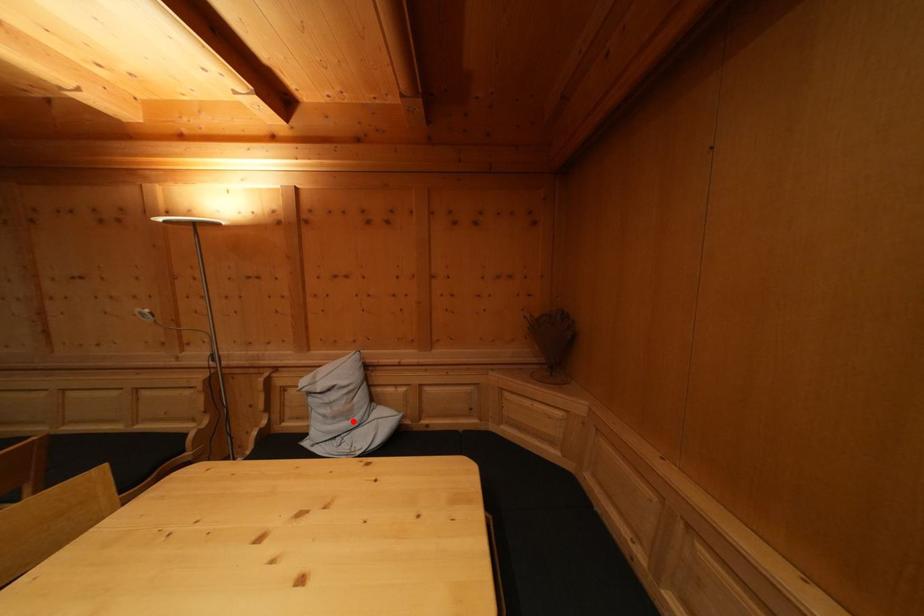
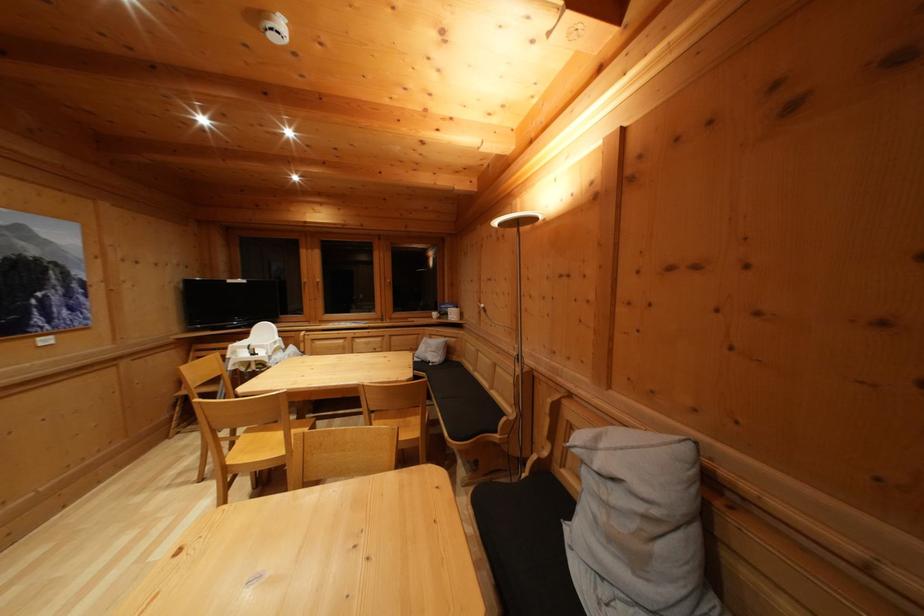
Where in the second image is the point corresponding to the highlighted location from the first image?

(640, 565)